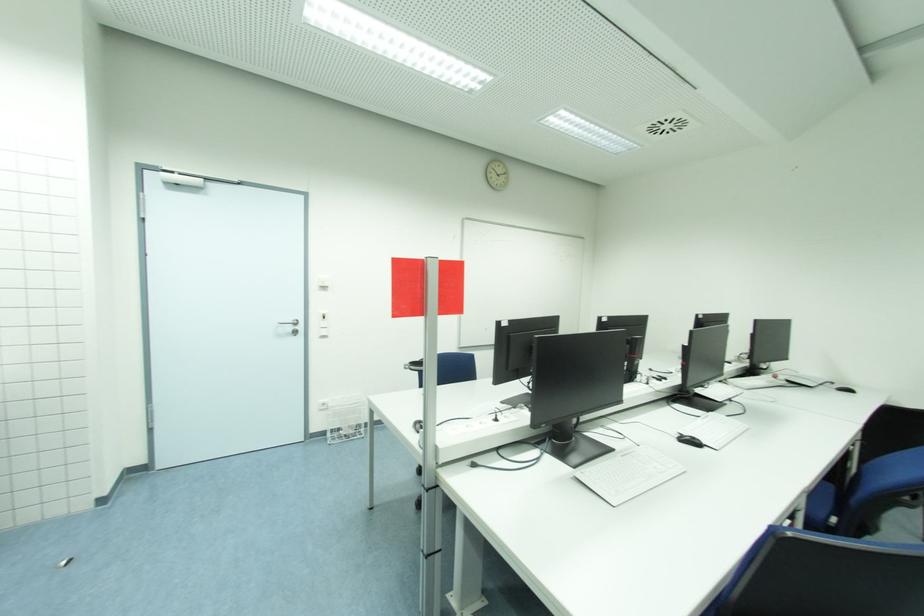
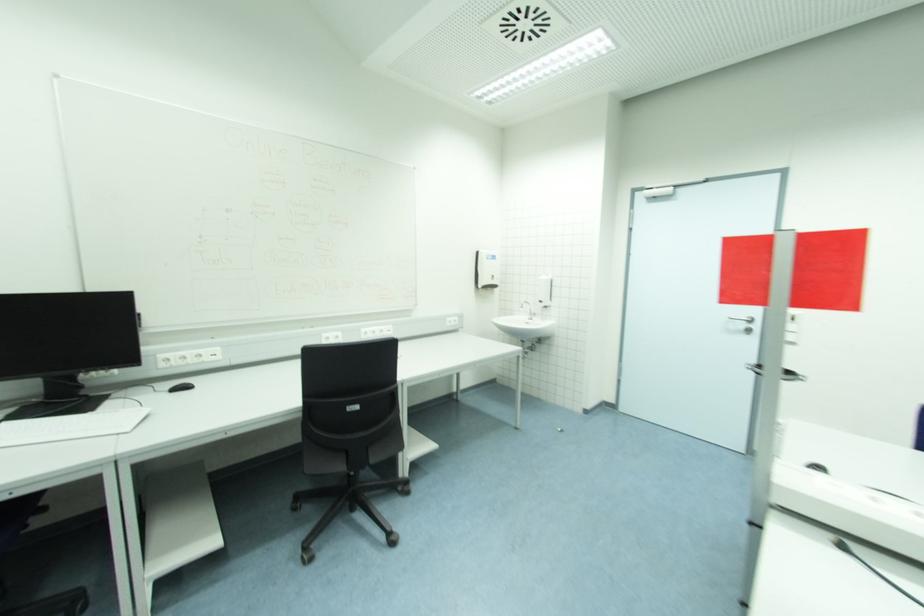
Locate, in the second image, the point that corresponds to (x=293, y=330) in the first image.

(746, 326)